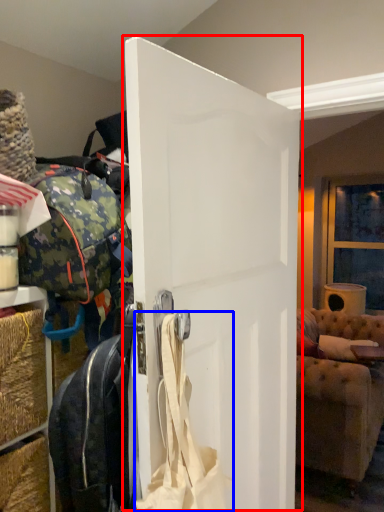
Question: Among these objects, which one is farthest to the camera, door (highlighted by a red box) or shoulder bag (highlighted by a blue box)?

Choices:
 (A) door
 (B) shoulder bag

Answer: (A)